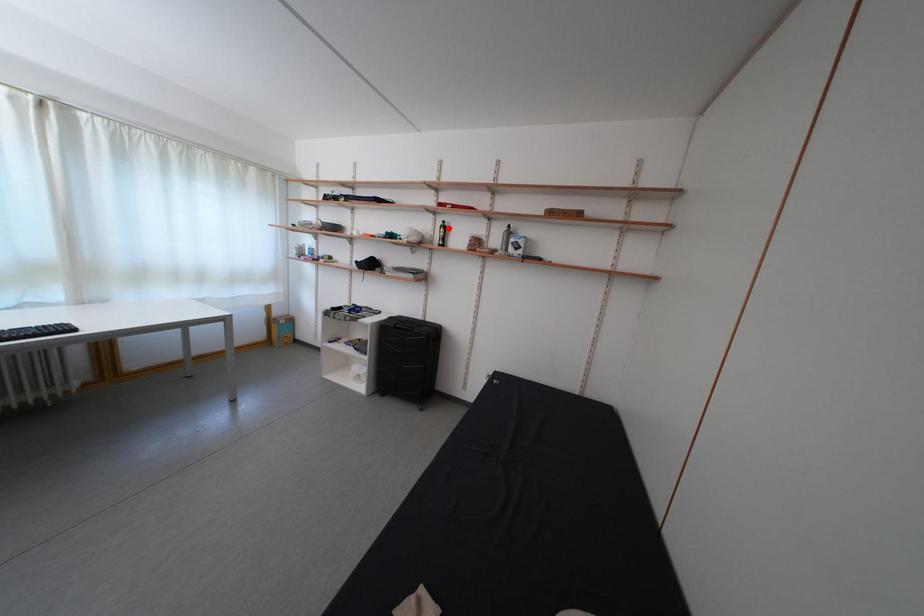
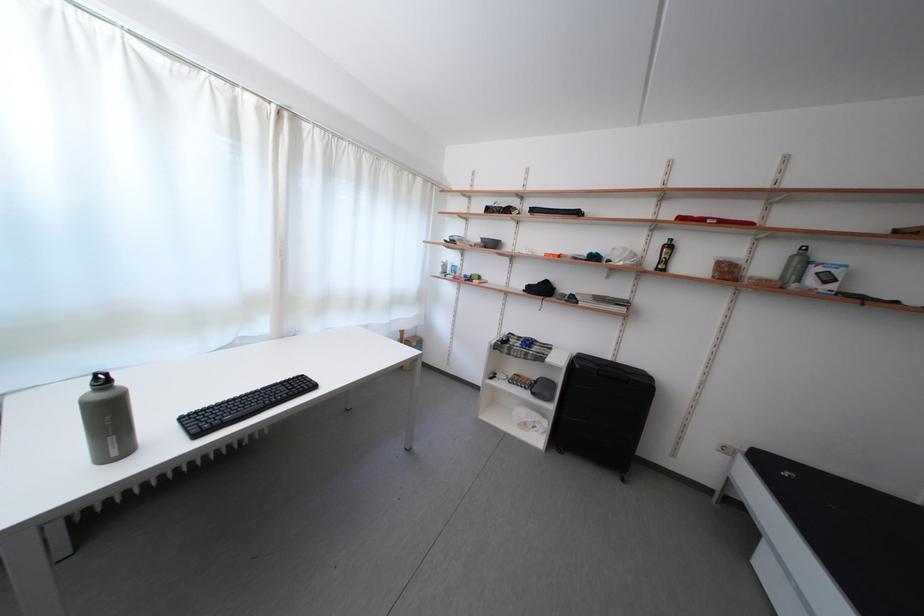
Where in the second image is the point corresponding to the highlighted location from the first image?

(669, 246)